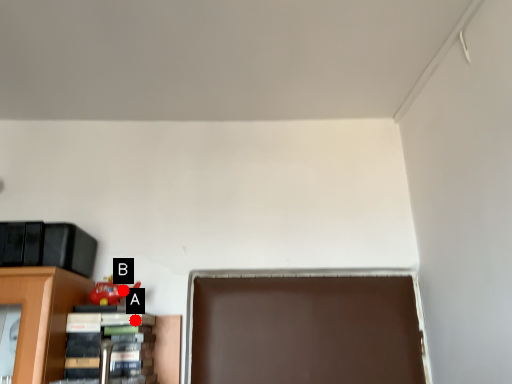
Question: Two points are circled on the image, labeled by A and B beside each circle. Among these points, which one is farthest from the camera?

Choices:
 (A) A is further
 (B) B is further

Answer: (B)